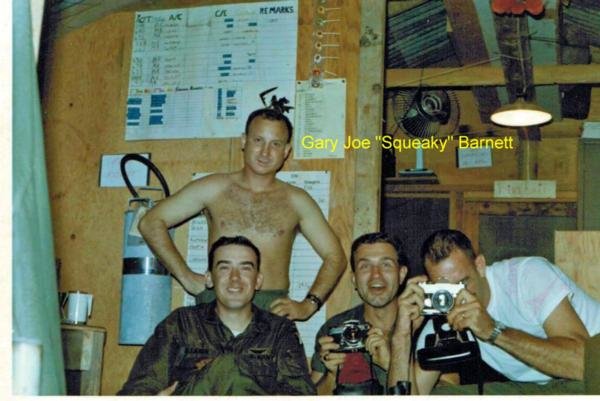
Where is `light`? This screenshot has width=600, height=401. light is located at coordinates (526, 109).